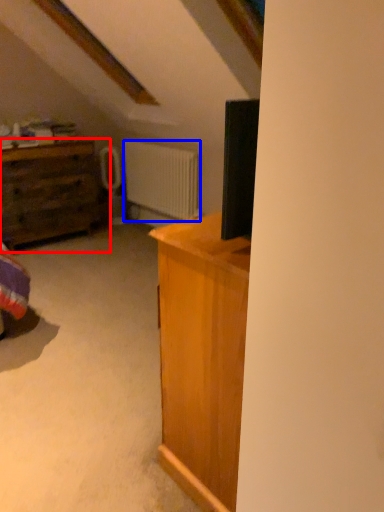
Question: Which point is closer to the camera, chest of drawers (highlighted by a red box) or radiator (highlighted by a blue box)?

Choices:
 (A) chest of drawers
 (B) radiator

Answer: (A)